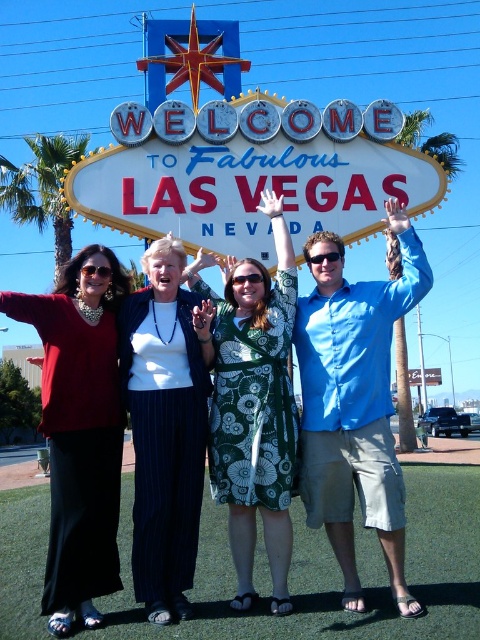
Looking at this image, is blue cotton shirt at center closer to the viewer compared to white knit sweater at center?

No, blue cotton shirt at center is behind white knit sweater at center.

What are the coordinates of `blue cotton shirt at center` in the screenshot? It's located at (355, 403).

Which of these two, blue cotton shirt at center or matte black dress at left, stands taller?

With more height is blue cotton shirt at center.

At what (x,y) coordinates should I click in order to perform the action: click on blue cotton shirt at center. Please return your answer as a coordinate pair (x, y). Looking at the image, I should click on (355, 403).

Is point (355, 301) in front of point (87, 584)?

No, (355, 301) is behind (87, 584).

In order to click on blue cotton shirt at center in this screenshot , I will do `click(355, 403)`.

Measure the distance between white metallic sign at center and matte black dress at left.

The distance of white metallic sign at center from matte black dress at left is 23.71 meters.

Which is more to the left, white metallic sign at center or matte black dress at left?

Positioned to the left is matte black dress at left.

Where is `white metallic sign at center`? white metallic sign at center is located at coordinates (252, 173).